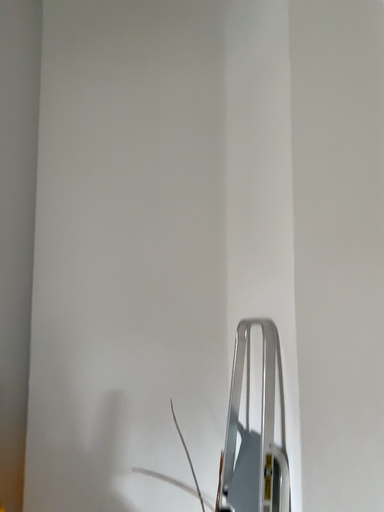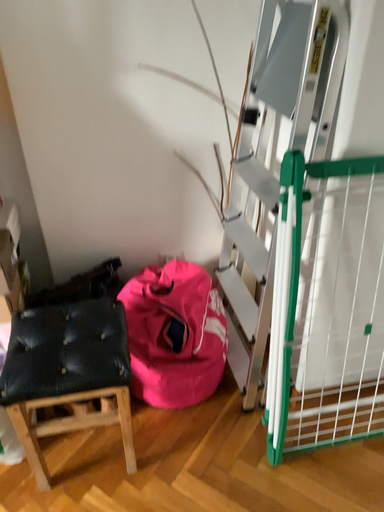
Question: How did the camera likely rotate when shooting the video?

Choices:
 (A) rotated downward
 (B) rotated upward

Answer: (A)